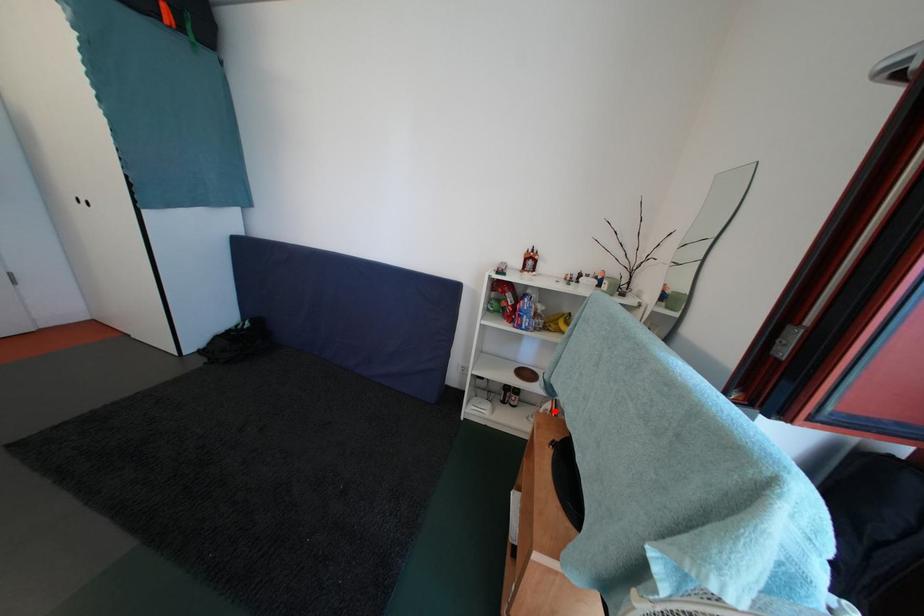
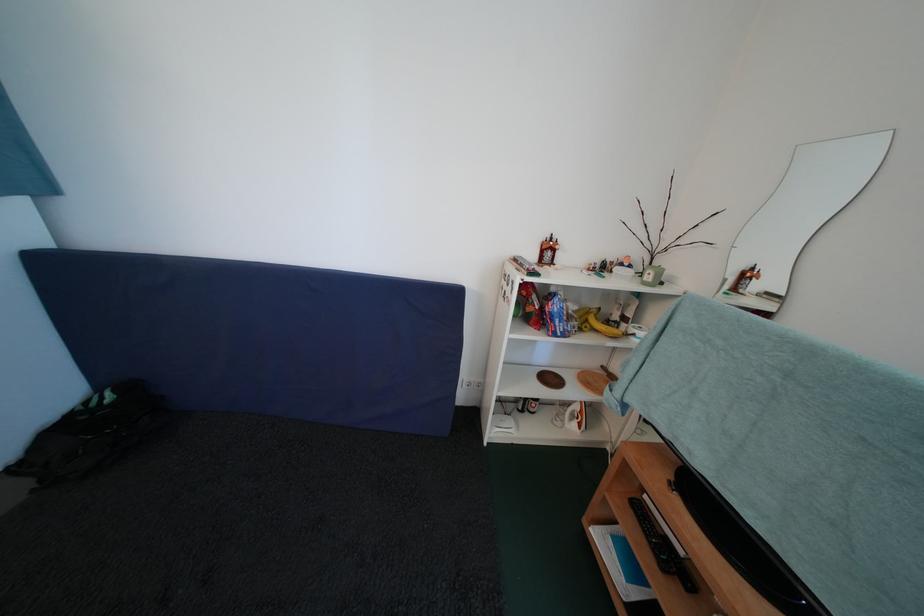
Locate, in the second image, the point that corresponds to the highlighted location in the first image.

(584, 411)